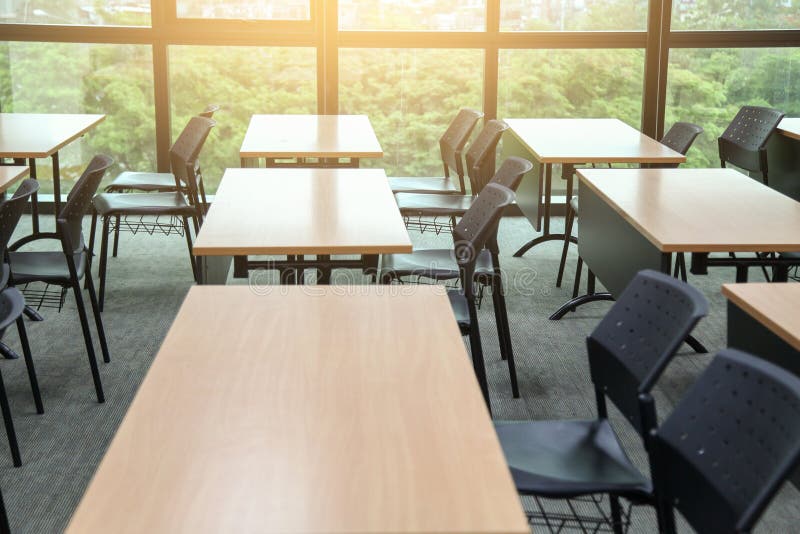
This screenshot has height=534, width=800. Identify the location of under-chair baskets. (50, 303), (150, 223), (130, 188), (428, 223), (444, 284), (554, 516), (790, 270).